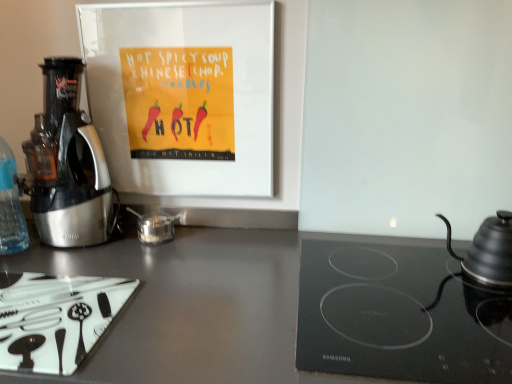
Question: From the image's perspective, relative to metallic silver coffee maker at left, is black glass cooktop at lower right above or below?

Choices:
 (A) above
 (B) below

Answer: (B)

Question: Visually, is black glass cooktop at lower right positioned to the left or to the right of metallic silver coffee maker at left?

Choices:
 (A) right
 (B) left

Answer: (A)

Question: Which is farther from the transparent glass tea pot at center?

Choices:
 (A) matte gray countertop at center
 (B) black matte kettle at right, which is the 2th kitchen appliance in left-to-right order
 (C) metallic silver coffee maker at left
 (D) black glass cooktop at lower right
 (E) transparent plastic bottle at left

Answer: (B)

Question: Which is farther from the metallic silver coffee maker at left?

Choices:
 (A) black glass cooktop at lower right
 (B) transparent plastic bottle at left
 (C) black matte kettle at right, which is the 2th kitchen appliance in left-to-right order
 (D) white glossy cutting board at lower left, marked as the first kitchen appliance in a left-to-right arrangement
 (E) transparent glass tea pot at center

Answer: (C)